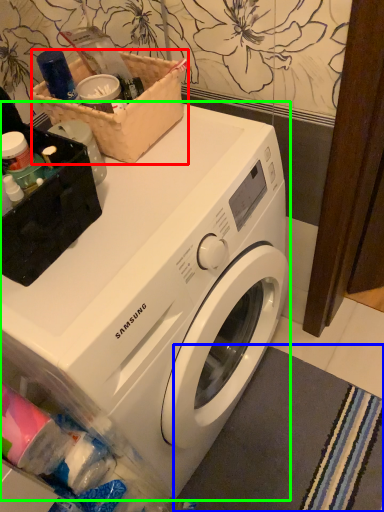
Question: Which is nearer to the basket (highlighted by a red box)? bath mat (highlighted by a blue box) or washing machine (highlighted by a green box).

Choices:
 (A) bath mat
 (B) washing machine

Answer: (B)